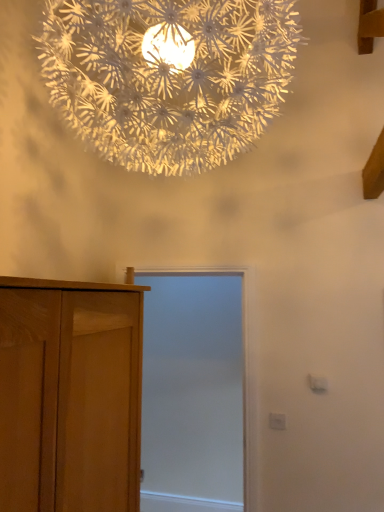
This screenshot has width=384, height=512. Find the location of `white matte screen door at center`. white matte screen door at center is located at coordinates (193, 389).

What is the approximate height of white paper-like at upper center?

white paper-like at upper center is 3.59 feet tall.

Measure the distance between point (x=73, y=442) and camera.

A distance of 3.85 feet exists between point (x=73, y=442) and camera.

This screenshot has width=384, height=512. What are the coordinates of `light brown wooden cupboard at left` in the screenshot? It's located at (81, 388).

Locate an element on the screen. This screenshot has width=384, height=512. white matte screen door at center is located at coordinates (193, 389).

Considering the sizes of white matte screen door at center and light brown wooden cupboard at left in the image, is white matte screen door at center bigger or smaller than light brown wooden cupboard at left?

Clearly, white matte screen door at center is smaller in size than light brown wooden cupboard at left.

Based on their positions, is white matte screen door at center located to the left or right of light brown wooden cupboard at left?

Based on their positions, white matte screen door at center is located to the right of light brown wooden cupboard at left.

From the picture: Are white paper-like at upper center and light brown wooden cupboard at left making contact?

No, white paper-like at upper center is not in contact with light brown wooden cupboard at left.

From the image's perspective, which is above, white paper-like at upper center or light brown wooden cupboard at left?

white paper-like at upper center is shown above in the image.

Would you say white paper-like at upper center is to the left or to the right of light brown wooden cupboard at left in the picture?

From the image, it's evident that white paper-like at upper center is to the right of light brown wooden cupboard at left.

In the scene shown: Is white paper-like at upper center aimed at light brown wooden cupboard at left?

No, white paper-like at upper center is not turned towards light brown wooden cupboard at left.

Considering the sizes of objects white paper-like at upper center and white matte screen door at center in the image provided, who is taller, white paper-like at upper center or white matte screen door at center?

Standing taller between the two is white matte screen door at center.

Is white matte screen door at center a part of white paper-like at upper center?

No, white matte screen door at center is not surrounded by white paper-like at upper center.

Looking at this image, can you confirm if white paper-like at upper center is positioned to the right of white matte screen door at center?

Incorrect, white paper-like at upper center is not on the right side of white matte screen door at center.

Is light brown wooden cupboard at left in contact with white matte screen door at center?

A: light brown wooden cupboard at left is not next to white matte screen door at center, and they're not touching.

From the image's perspective, is light brown wooden cupboard at left located above or below white matte screen door at center?

From the image's perspective, light brown wooden cupboard at left appears above white matte screen door at center.

Where is `screen door that is under the light brown wooden cupboard at left (from a real-world perspective)`? screen door that is under the light brown wooden cupboard at left (from a real-world perspective) is located at coordinates (193, 389).

At what (x,y) coordinates should I click in order to perform the action: click on screen door on the right of white paper-like at upper center. Please return your answer as a coordinate pair (x, y). Looking at the image, I should click on (193, 389).

Is white matte screen door at center inside the boundaries of white paper-like at upper center, or outside?

white matte screen door at center cannot be found inside white paper-like at upper center.

Is white matte screen door at center bigger or smaller than white paper-like at upper center?

Clearly, white matte screen door at center is smaller in size than white paper-like at upper center.

Is white matte screen door at center positioned in front of white paper-like at upper center?

No, the depth of white matte screen door at center is greater than that of white paper-like at upper center.

Is light brown wooden cupboard at left positioned beyond the bounds of white paper-like at upper center?

light brown wooden cupboard at left is positioned outside white paper-like at upper center.

From the picture: Which of these two, light brown wooden cupboard at left or white paper-like at upper center, is wider?

white paper-like at upper center is wider.

Based on the photo, what's the angular difference between light brown wooden cupboard at left and white paper-like at upper center's facing directions?

light brown wooden cupboard at left and white paper-like at upper center are facing 90 degrees away from each other.

Locate an element on the screen. This screenshot has width=384, height=512. cupboard to the left of white matte screen door at center is located at coordinates (81, 388).

Find the location of a particular element. lamp above the light brown wooden cupboard at left (from the image's perspective) is located at coordinates (168, 76).

Based on their spatial positions, is light brown wooden cupboard at left or white paper-like at upper center further from white matte screen door at center?

white paper-like at upper center.

When comparing their distances from white paper-like at upper center, does white matte screen door at center or light brown wooden cupboard at left seem closer?

The object closer to white paper-like at upper center is light brown wooden cupboard at left.

Based on their spatial positions, is light brown wooden cupboard at left or white matte screen door at center further from white paper-like at upper center?

Among the two, white matte screen door at center is located further to white paper-like at upper center.

Looking at the image, which one is located further to light brown wooden cupboard at left, white matte screen door at center or white paper-like at upper center?

white matte screen door at center lies further to light brown wooden cupboard at left than the other object.

When comparing their distances from light brown wooden cupboard at left, does white paper-like at upper center or white matte screen door at center seem further?

white matte screen door at center is further to light brown wooden cupboard at left.

When comparing their distances from white matte screen door at center, does white paper-like at upper center or light brown wooden cupboard at left seem further?

white paper-like at upper center is further to white matte screen door at center.

This screenshot has width=384, height=512. Find the location of `lamp positioned between light brown wooden cupboard at left and white matte screen door at center from near to far`. lamp positioned between light brown wooden cupboard at left and white matte screen door at center from near to far is located at coordinates (168, 76).